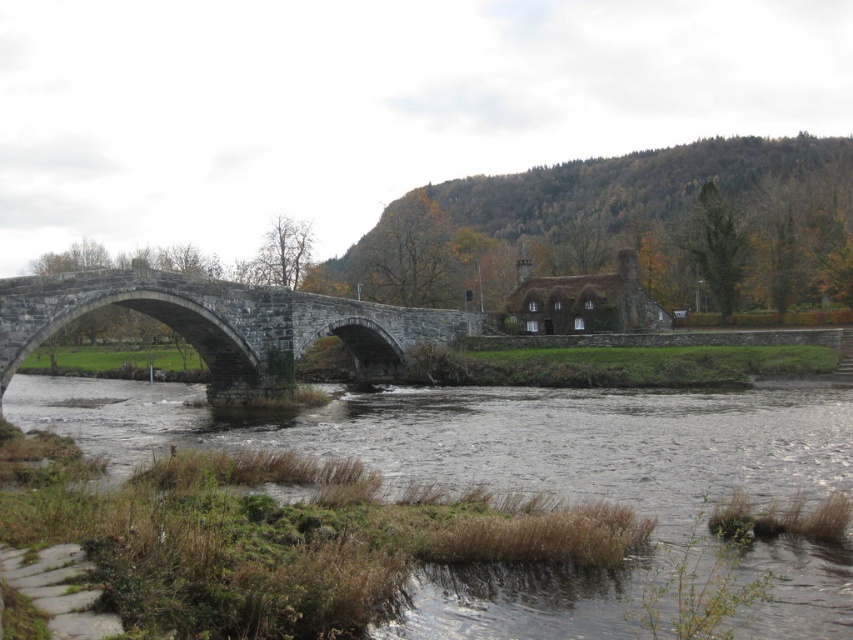
Question: Which object is farther from the camera taking this photo?

Choices:
 (A) brown grassy river at lower left
 (B) stone bridge at center

Answer: (B)

Question: Which of the following is the closest to the observer?

Choices:
 (A) brown grassy river at lower left
 (B) stone bridge at center

Answer: (A)

Question: Does brown grassy river at lower left have a lesser width compared to stone bridge at center?

Choices:
 (A) yes
 (B) no

Answer: (B)

Question: Does brown grassy river at lower left appear over stone bridge at center?

Choices:
 (A) yes
 (B) no

Answer: (B)

Question: Which object appears farthest from the camera in this image?

Choices:
 (A) brown grassy river at lower left
 (B) stone bridge at center

Answer: (B)

Question: Does brown grassy river at lower left have a greater width compared to stone bridge at center?

Choices:
 (A) yes
 (B) no

Answer: (A)